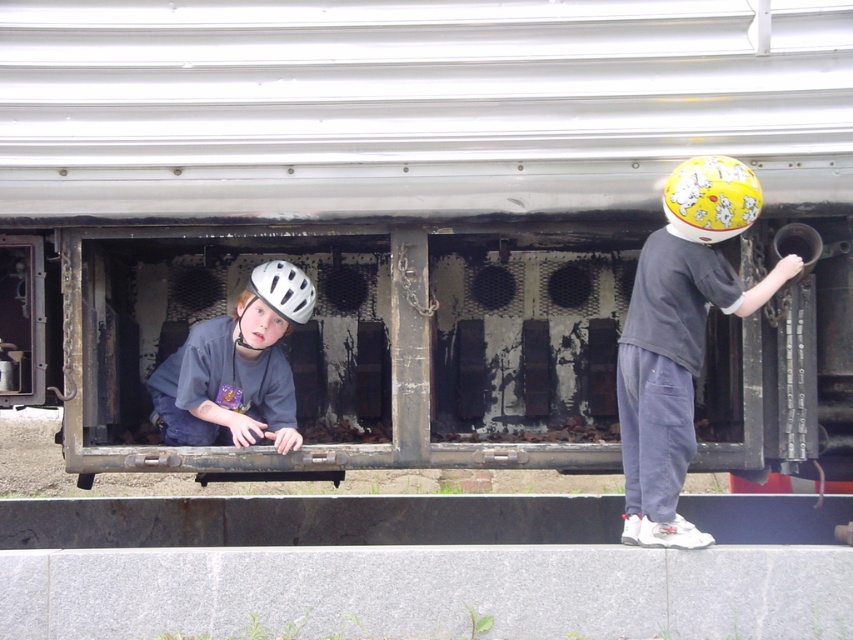
Between matte gray helmet at left and white matte safety helmet at left, which one appears on the left side from the viewer's perspective?

matte gray helmet at left is more to the left.

Between matte gray helmet at left and white matte safety helmet at left, which one is positioned lower?

matte gray helmet at left

I want to click on matte gray helmet at left, so [236, 369].

Does yellow matte helmet at upper right have a lesser height compared to white matte safety helmet at left?

No.

Is point (709, 179) behind point (267, 272)?

No.

Where is `yellow matte helmet at upper right`? yellow matte helmet at upper right is located at coordinates (711, 198).

Is yellow matte helmet at right thinner than white matte safety helmet at left?

No.

Is point (624, 522) positioned in front of point (264, 266)?

That is True.

Between point (624, 422) and point (299, 276), which one is positioned in front?

Point (624, 422)

At what (x,y) coordinates should I click in order to perform the action: click on yellow matte helmet at right. Please return your answer as a coordinate pair (x, y). The image size is (853, 640). Looking at the image, I should click on (679, 337).